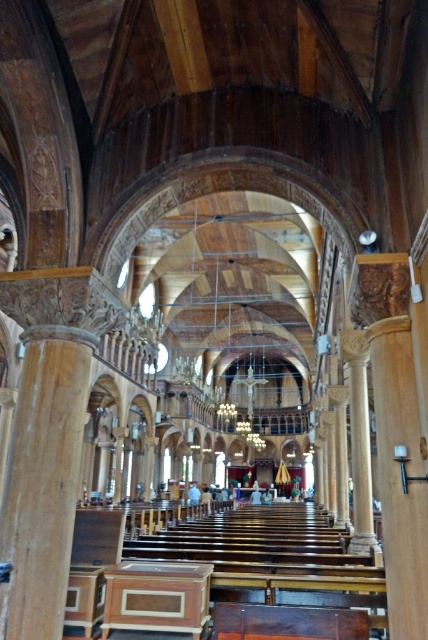
You are standing inside the grand wooden church and want to determine the relative positions of two specific points marked in the image. Which of the two points, point (x=44, y=476) or point (x=140, y=616), is closer to you?

Point (x=44, y=476) is closer to the viewer than point (x=140, y=616).

You are standing at the entrance of the church and want to see both the polished wood column at center and the wooden altar at center. Which one will you see first as you walk towards the center of the church?

You will see the polished wood column at center first because it is located above the wooden altar at center, making it visible from a greater distance as you approach the center of the church.